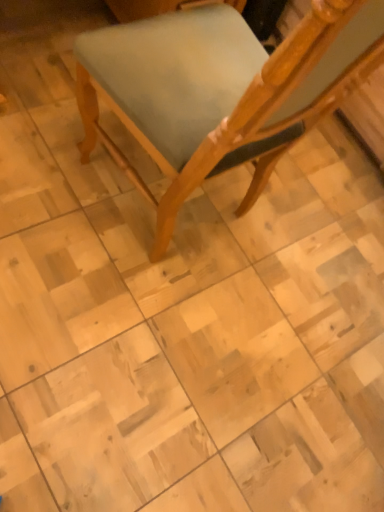
What is the approximate height of wooden chair at center?

The height of wooden chair at center is 37.80 inches.

What do you see at coordinates (220, 91) in the screenshot? I see `wooden chair at center` at bounding box center [220, 91].

Where is `wooden chair at center`? This screenshot has width=384, height=512. wooden chair at center is located at coordinates (220, 91).

I want to click on wooden chair at center, so click(220, 91).